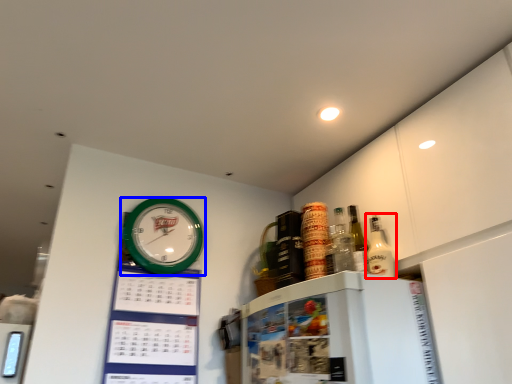
Question: Which of the following is the closest to the observer, bottle (highlighted by a red box) or wall clock (highlighted by a blue box)?

Choices:
 (A) bottle
 (B) wall clock

Answer: (A)